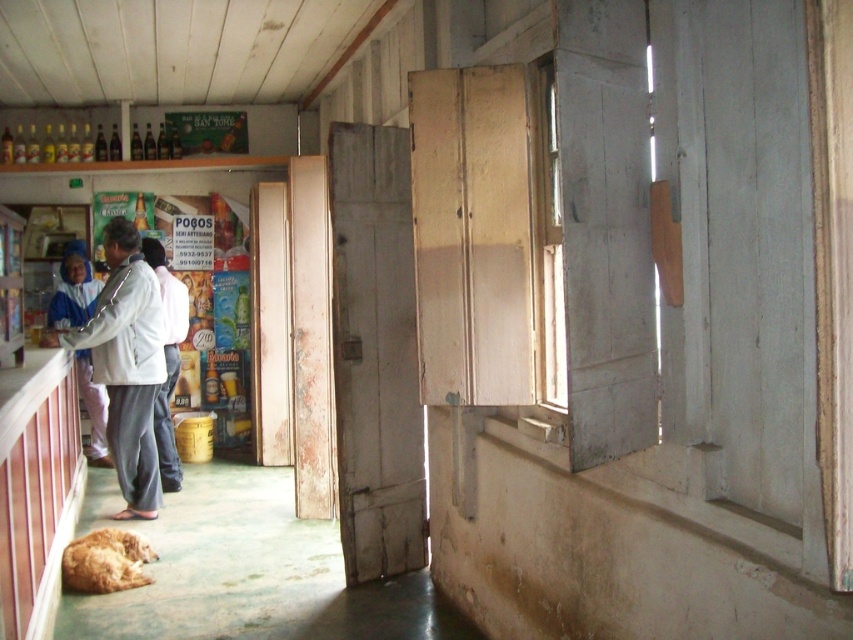
Is white matte jacket at left shorter than golden fur dog at lower left?

In fact, white matte jacket at left may be taller than golden fur dog at lower left.

Is white matte jacket at left positioned in front of golden fur dog at lower left?

No, it is not.

You are a GUI agent. You are given a task and a screenshot of the screen. Output one action in this format:
    pyautogui.click(x=<x>, y=<y>)
    Task: Click on the white matte jacket at left
    The image size is (853, 640).
    Given the screenshot: What is the action you would take?
    pyautogui.click(x=126, y=364)

Who is taller, white matte jacket at left or white fabric shirt at center?

white matte jacket at left

Between white matte jacket at left and white fabric shirt at center, which one appears on the right side from the viewer's perspective?

From the viewer's perspective, white fabric shirt at center appears more on the right side.

Is point (107, 304) farther from camera compared to point (164, 404)?

No, it is not.

Image resolution: width=853 pixels, height=640 pixels. What are the coordinates of `white matte jacket at left` in the screenshot? It's located at (126, 364).

Which of these two, white matte jacket at left or blue fabric headscarf at left, stands taller?

With more height is white matte jacket at left.

Between point (120, 326) and point (71, 278), which one is positioned in front?

Point (120, 326)

What are the coordinates of `white matte jacket at left` in the screenshot? It's located at (126, 364).